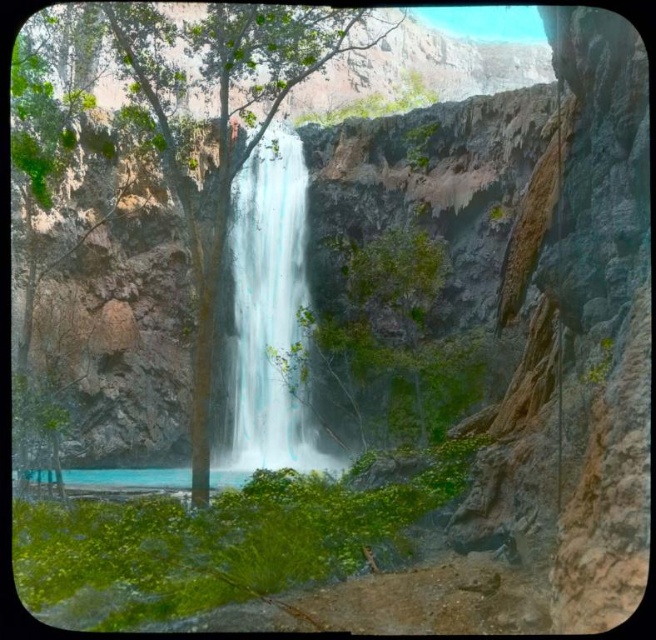
Question: From the image, what is the correct spatial relationship of white smooth waterfall at center in relation to turquoise glossy water at center?

Choices:
 (A) above
 (B) below

Answer: (A)

Question: Which of the following is the closest to the observer?

Choices:
 (A) white smooth waterfall at center
 (B) turquoise glossy water at center

Answer: (B)

Question: Which of the following is the farthest from the observer?

Choices:
 (A) turquoise glossy water at center
 (B) white smooth waterfall at center

Answer: (B)

Question: Is the position of green leafy tree at center less distant than that of white smooth waterfall at center?

Choices:
 (A) yes
 (B) no

Answer: (A)

Question: Which object is farther from the camera taking this photo?

Choices:
 (A) white smooth waterfall at center
 (B) turquoise glossy water at center
 (C) green leafy tree at center

Answer: (A)

Question: Is green leafy tree at center to the right of white smooth waterfall at center from the viewer's perspective?

Choices:
 (A) yes
 (B) no

Answer: (A)